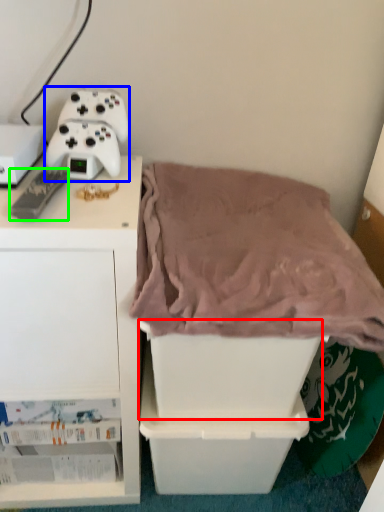
Question: Estimate the real-world distances between objects in this image. Which object is closer to storage box (highlighted by a red box), game controller (highlighted by a blue box) or game controller (highlighted by a green box)?

Choices:
 (A) game controller
 (B) game controller

Answer: (A)